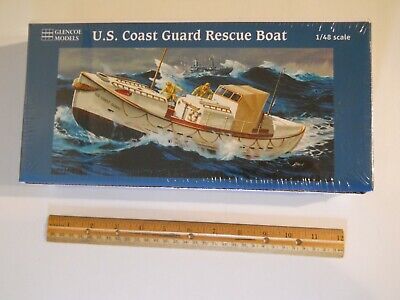
At what (x,y) coordinates should I click in order to perform the action: click on white table. Please return your answer as a coordinate pair (x, y). Looking at the image, I should click on (365, 203).